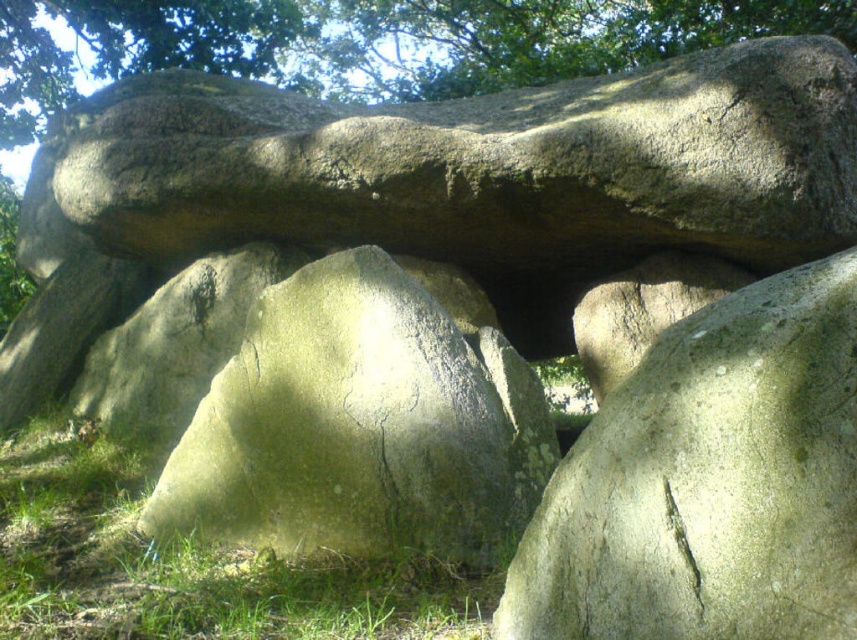
Between green leafy tree at upper center and green grass at lower left, which one appears on the left side from the viewer's perspective?

Positioned to the left is green grass at lower left.

Between green leafy tree at upper center and green grass at lower left, which one is positioned higher?

Positioned higher is green leafy tree at upper center.

The width and height of the screenshot is (857, 640). I want to click on green leafy tree at upper center, so click(370, 42).

The width and height of the screenshot is (857, 640). Describe the element at coordinates (361, 426) in the screenshot. I see `greenish-gray rock at center` at that location.

Who is more forward, [328,278] or [121,60]?

Point [328,278] is in front.

Between point (439, 448) and point (207, 28), which one is positioned in front?

Point (439, 448) is more forward.

In order to click on greenish-gray rock at center in this screenshot , I will do `click(361, 426)`.

The height and width of the screenshot is (640, 857). I want to click on smooth gray rock at center, so click(x=710, y=481).

Can you confirm if smooth gray rock at center is positioned above green grass at lower left?

Yes.

The width and height of the screenshot is (857, 640). What do you see at coordinates (710, 481) in the screenshot? I see `smooth gray rock at center` at bounding box center [710, 481].

This screenshot has height=640, width=857. Find the location of `smooth gray rock at center`. smooth gray rock at center is located at coordinates (710, 481).